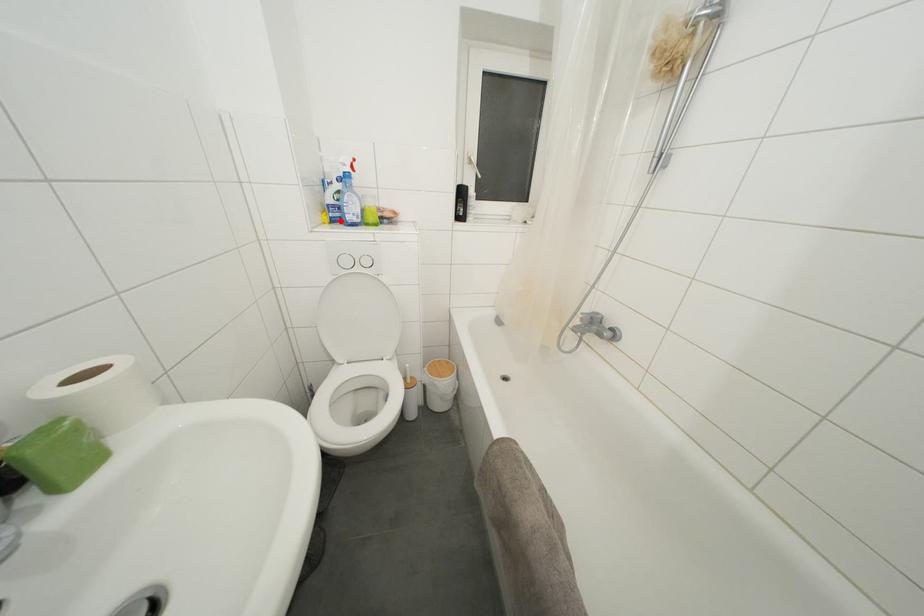
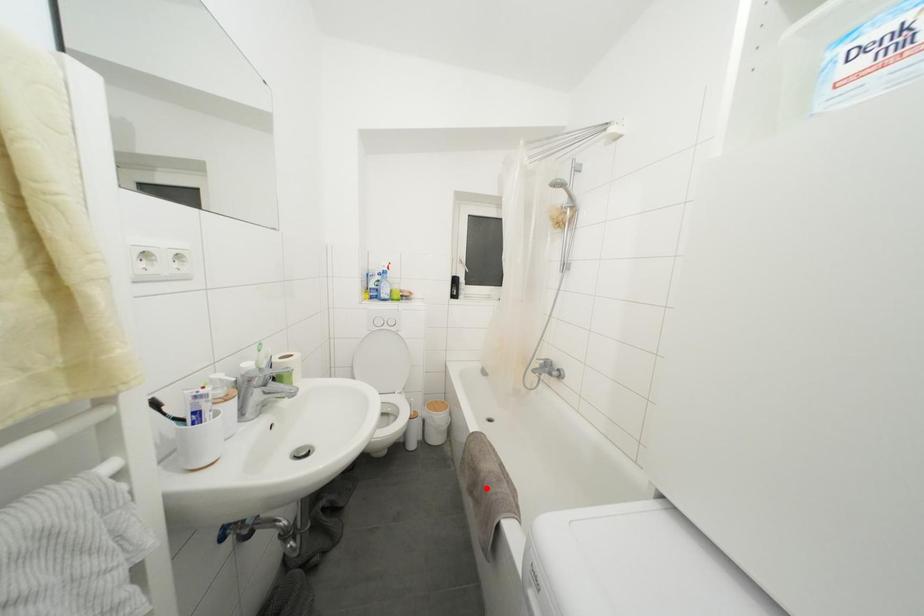
I am providing you with two images of the same scene from different viewpoints. A red point is marked on the first image and another point is marked on the second image. Is the marked point in image1 the same physical position as the marked point in image2?

No